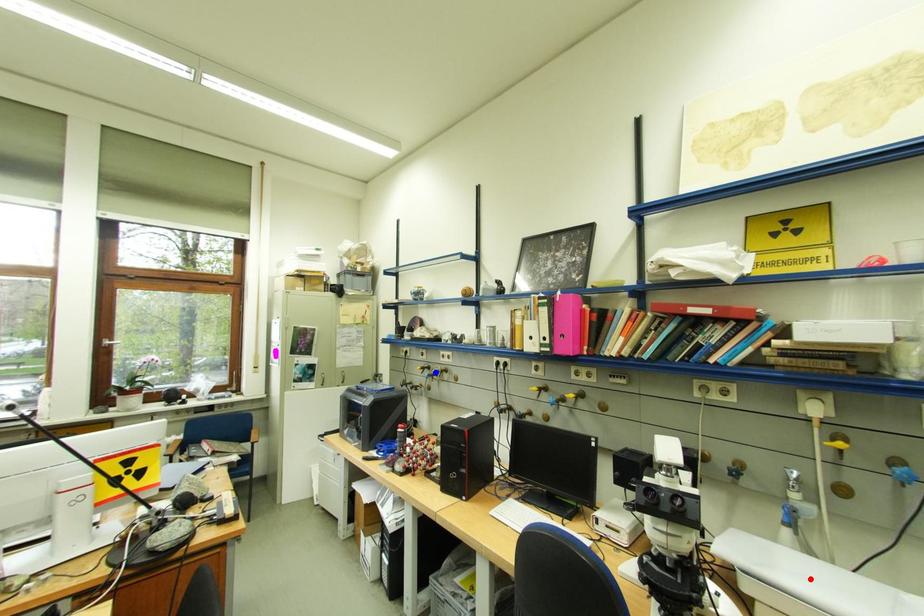
Question: Which of the two points in the image is closer to the camera?

Choices:
 (A) Blue point is closer.
 (B) Red point is closer.

Answer: (B)